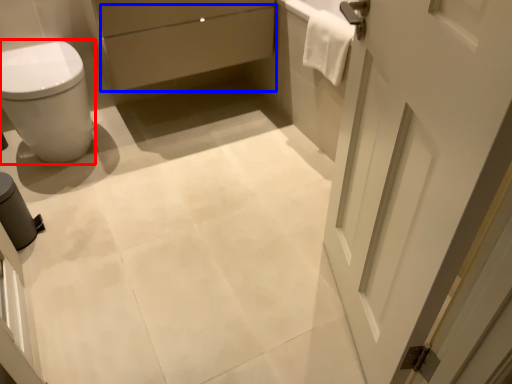
Question: Which of the following is the farthest to the observer, bidet (highlighted by a red box) or drawer (highlighted by a blue box)?

Choices:
 (A) bidet
 (B) drawer

Answer: (B)